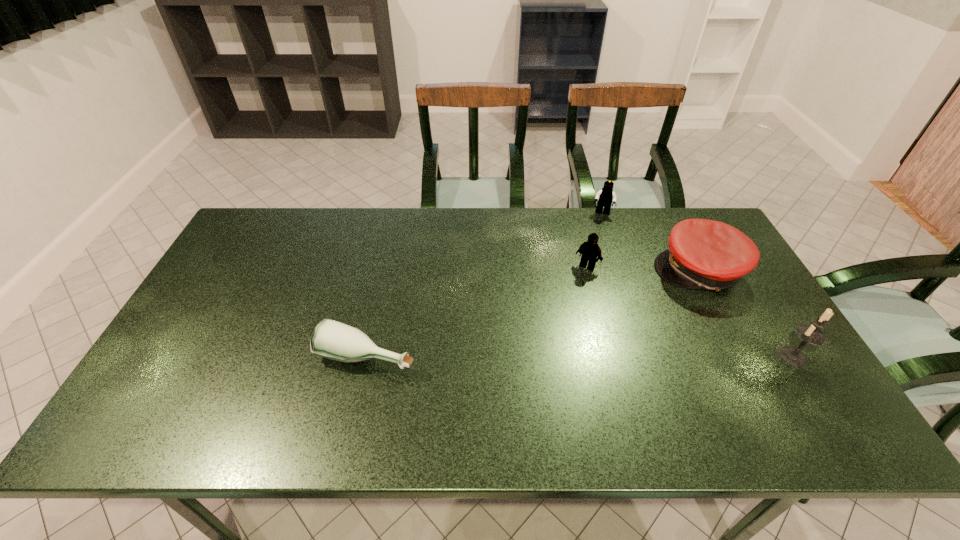
In the image, there is a desktop. Where is `vacant space at the far right corner`? This screenshot has height=540, width=960. vacant space at the far right corner is located at coordinates (704, 218).

I want to click on vacant area at the near right corner, so click(779, 399).

The width and height of the screenshot is (960, 540). Find the location of `free space between the nearer Lego and the leftmost object`. free space between the nearer Lego and the leftmost object is located at coordinates (477, 311).

Identify the location of vacant space that is in between the fourth object from right to left and the cap. pyautogui.click(x=643, y=269).

Identify the location of vacant space in between the cap and the left Lego. (643, 269).

Identify the location of vacant region between the bottle and the right Lego. (485, 285).

What are the coordinates of `free space between the cap and the second object from left to right` in the screenshot? It's located at (643, 269).

The image size is (960, 540). What are the coordinates of `vacant space in between the candle holder and the bottle` in the screenshot? It's located at (580, 356).

Where is `vacant region between the shortest object and the nearer Lego`? The height and width of the screenshot is (540, 960). vacant region between the shortest object and the nearer Lego is located at coordinates (477, 311).

This screenshot has width=960, height=540. In order to click on free space between the farther Lego and the leftmost object in this screenshot , I will do `click(485, 285)`.